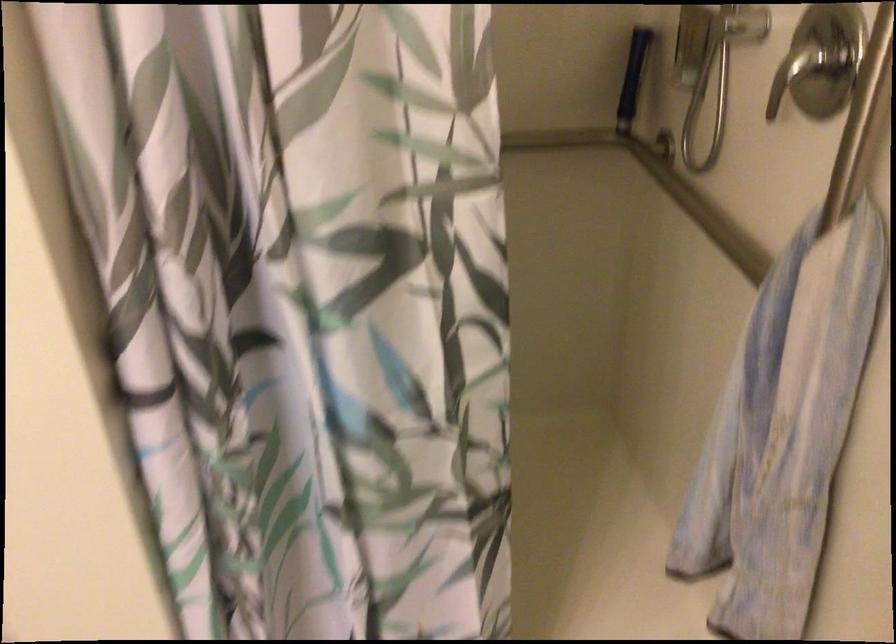
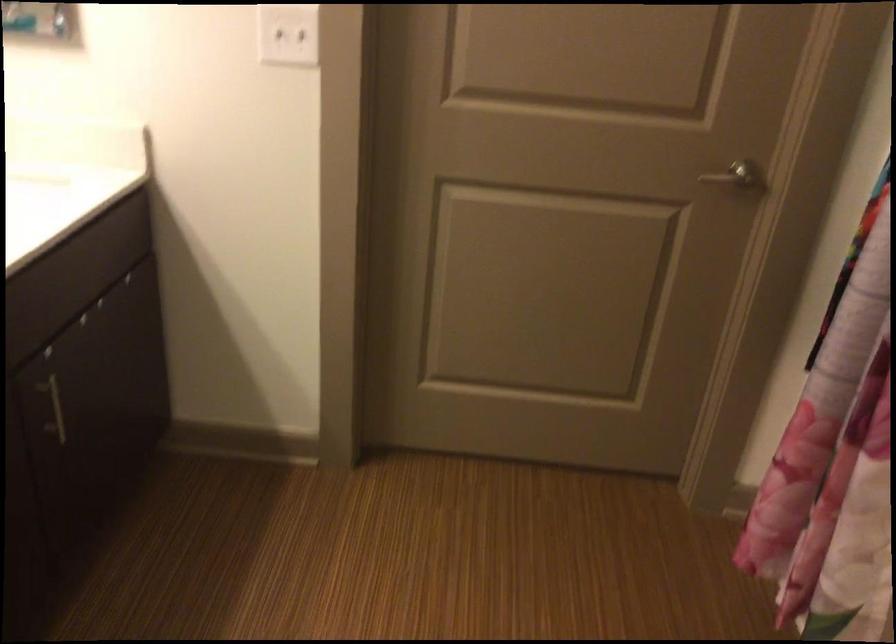
Based on the continuous images, in which direction is the camera rotating?

The rotation direction of the camera is left-down.